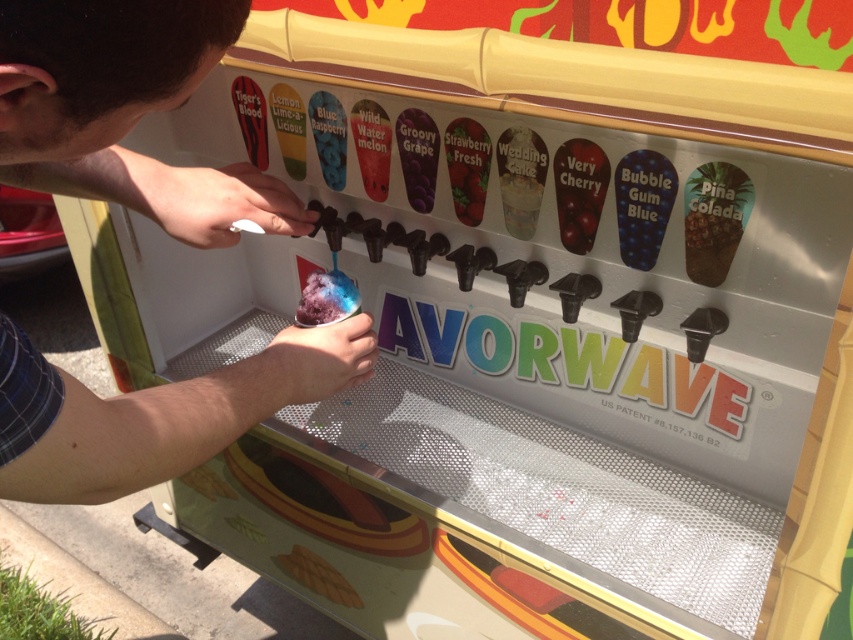
Is point (45, 397) positioned before point (509, 163)?

Yes, point (45, 397) is closer to viewer.

Locate an element on the screen. matte black cup at center is located at coordinates (125, 109).

Can you confirm if matte white wedding cake at center is smaller than gelatinous blue ice cream at center?

Correct, matte white wedding cake at center occupies less space than gelatinous blue ice cream at center.

The image size is (853, 640). In order to click on matte white wedding cake at center in this screenshot , I will do `click(520, 179)`.

The image size is (853, 640). What are the coordinates of `matte white wedding cake at center` in the screenshot? It's located at (520, 179).

Does matte black cup at center have a lesser width compared to gelatinous blue ice cream at center?

No, matte black cup at center is not thinner than gelatinous blue ice cream at center.

Does matte black cup at center have a smaller size compared to gelatinous blue ice cream at center?

Actually, matte black cup at center might be larger than gelatinous blue ice cream at center.

Which is behind, point (264, 204) or point (323, 312)?

The point (323, 312) is more distant.

The image size is (853, 640). I want to click on matte black cup at center, so click(125, 109).